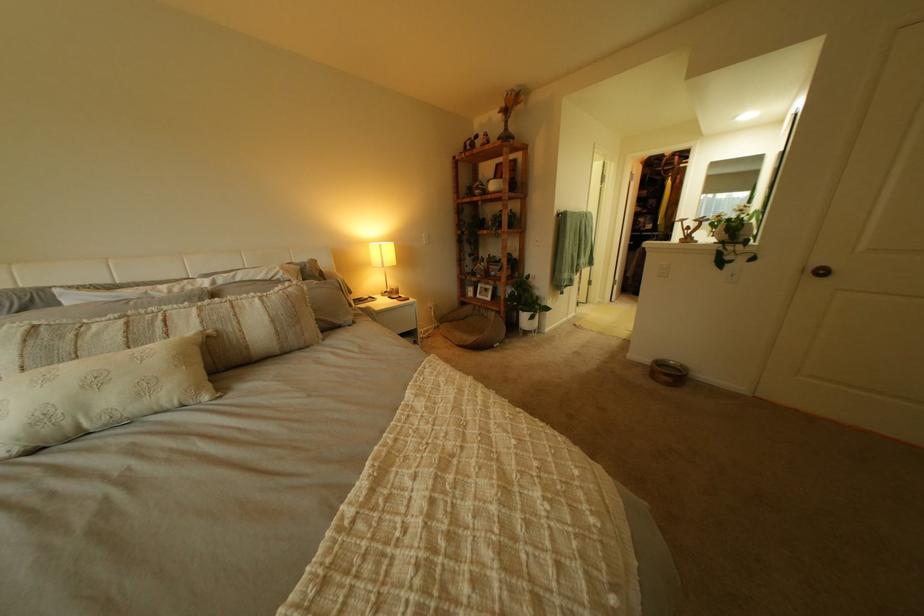
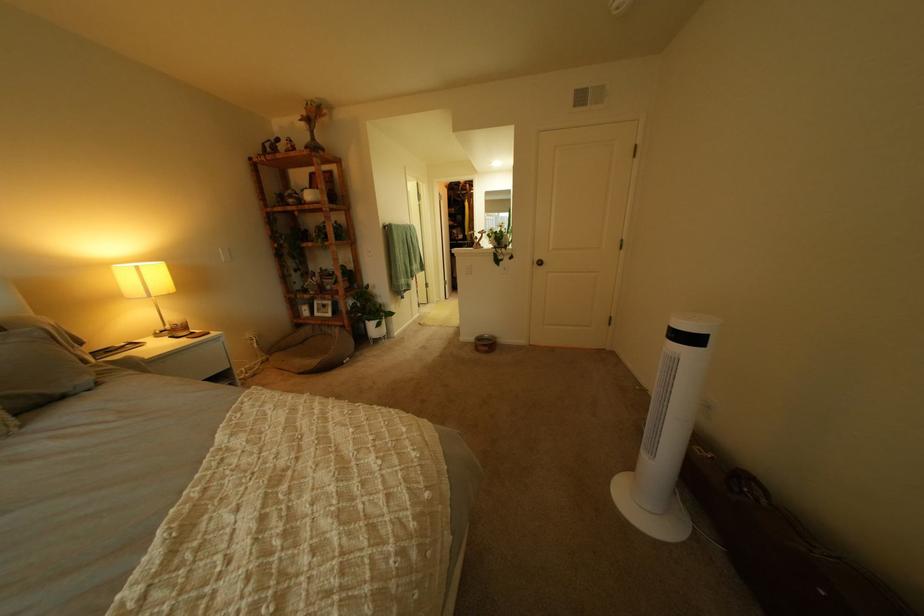
In the second image, find the point that corresponds to (x=370, y=323) in the first image.

(115, 385)